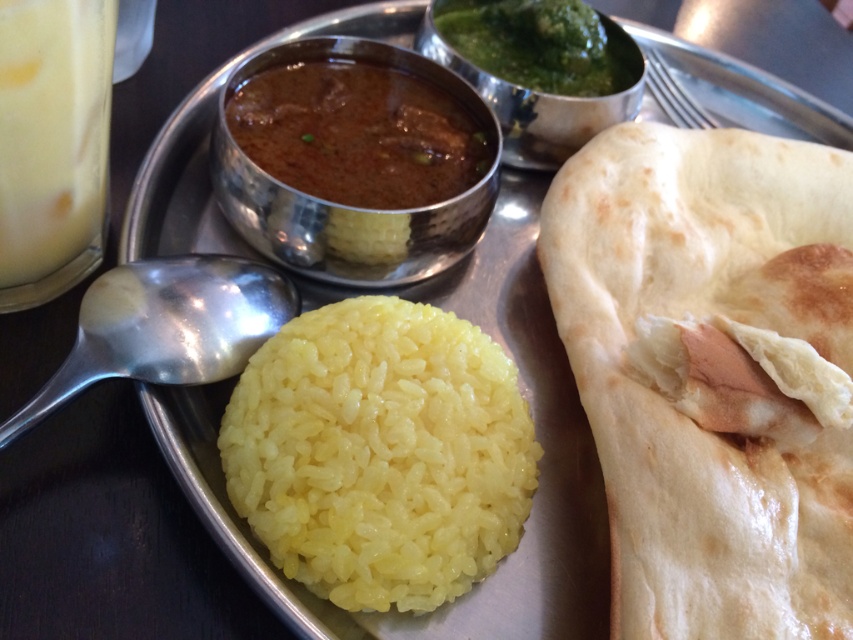
Where is `golden brown dough at right`? golden brown dough at right is located at coordinates (676, 401).

In order to click on golden brown dough at right in this screenshot , I will do `click(676, 401)`.

Who is positioned more to the right, brown matte curry at center or milky white liquid at left?

brown matte curry at center is more to the right.

Does brown matte curry at center appear over milky white liquid at left?

Indeed, brown matte curry at center is positioned over milky white liquid at left.

Is point (263, 177) more distant than point (68, 250)?

That is True.

In order to click on brown matte curry at center in this screenshot , I will do `click(352, 156)`.

Is golden brown dough at right to the right of yellow polished rice at center from the viewer's perspective?

Correct, you'll find golden brown dough at right to the right of yellow polished rice at center.

Is golden brown dough at right below yellow polished rice at center?

Actually, golden brown dough at right is above yellow polished rice at center.

The height and width of the screenshot is (640, 853). Describe the element at coordinates (676, 401) in the screenshot. I see `golden brown dough at right` at that location.

Identify the location of golden brown dough at right. Image resolution: width=853 pixels, height=640 pixels. (676, 401).